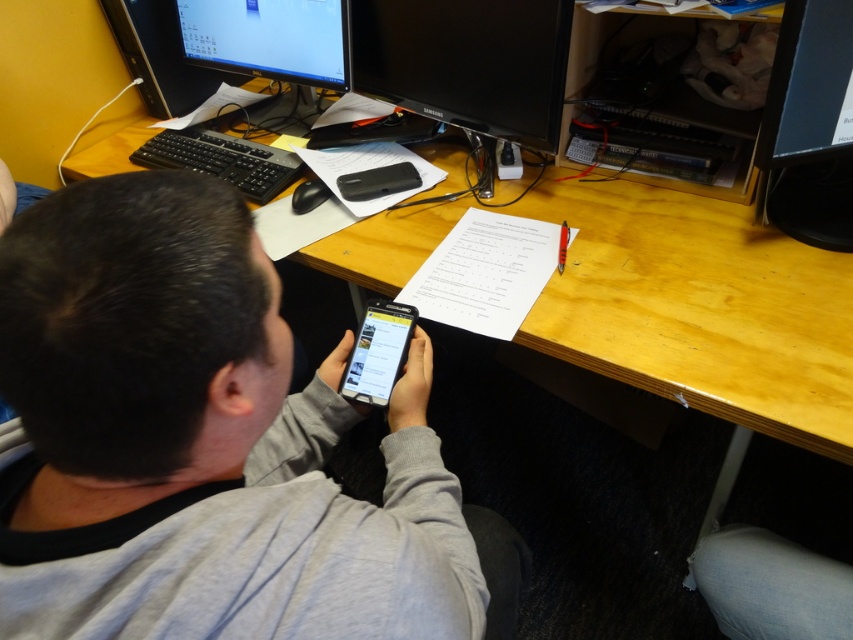
Does point (519, 96) come closer to viewer compared to point (805, 42)?

No.

Can you confirm if black glossy monitor at center is positioned to the left of black glossy monitor at upper right?

Correct, you'll find black glossy monitor at center to the left of black glossy monitor at upper right.

In order to click on black glossy monitor at center in this screenshot , I will do `click(467, 61)`.

Who is positioned more to the right, black glossy monitor at upper right or matte black monitor at upper left?

Positioned to the right is black glossy monitor at upper right.

In the scene shown: Does black glossy monitor at upper right appear on the left side of matte black monitor at upper left?

No, black glossy monitor at upper right is not to the left of matte black monitor at upper left.

Which is behind, point (791, 26) or point (331, 13)?

The point (331, 13) is behind.

At what (x,y) coordinates should I click in order to perform the action: click on black glossy monitor at upper right. Please return your answer as a coordinate pair (x, y). The image size is (853, 640). Looking at the image, I should click on (810, 124).

Is point (71, 305) closer to viewer compared to point (410, 93)?

Yes, point (71, 305) is closer to viewer.

Can you confirm if gray fabric shirt at center is positioned to the left of black glossy monitor at center?

Indeed, gray fabric shirt at center is positioned on the left side of black glossy monitor at center.

Describe the element at coordinates (198, 442) in the screenshot. I see `gray fabric shirt at center` at that location.

Where is `gray fabric shirt at center`? The height and width of the screenshot is (640, 853). gray fabric shirt at center is located at coordinates (198, 442).